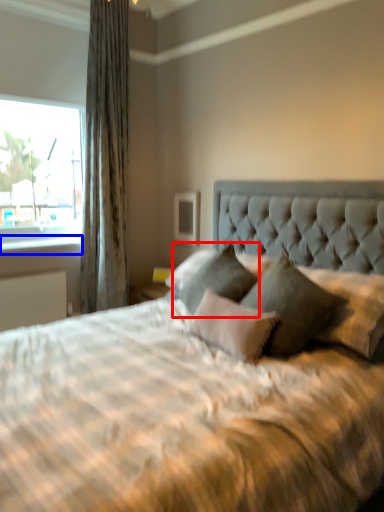
Question: Which point is further to the camera, pillow (highlighted by a red box) or window sill (highlighted by a blue box)?

Choices:
 (A) pillow
 (B) window sill

Answer: (B)